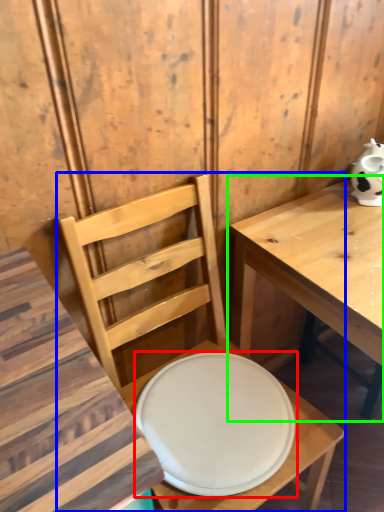
Question: Estimate the real-world distances between objects in this image. Which object is closer to plate (highlighted by a red box), chair (highlighted by a blue box) or table (highlighted by a green box)?

Choices:
 (A) chair
 (B) table

Answer: (A)